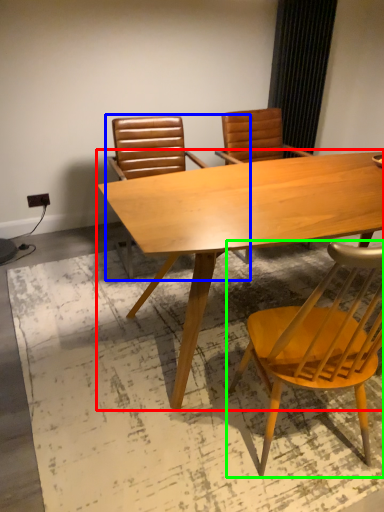
Question: Which object is the farthest from table (highlighted by a red box)? Choose among these: chair (highlighted by a blue box) or chair (highlighted by a green box).

Choices:
 (A) chair
 (B) chair

Answer: (A)